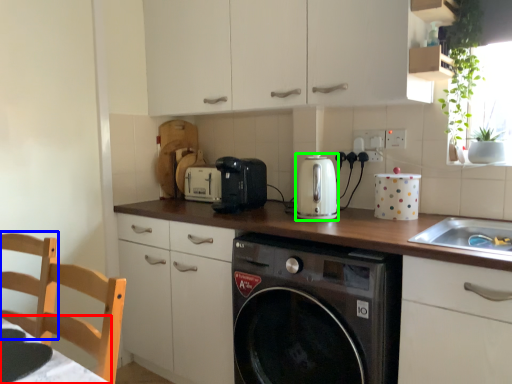
Question: Considering the real-world distances, which object is closest to table (highlighted by a red box)? chair (highlighted by a blue box) or kitchen appliance (highlighted by a green box).

Choices:
 (A) chair
 (B) kitchen appliance

Answer: (A)